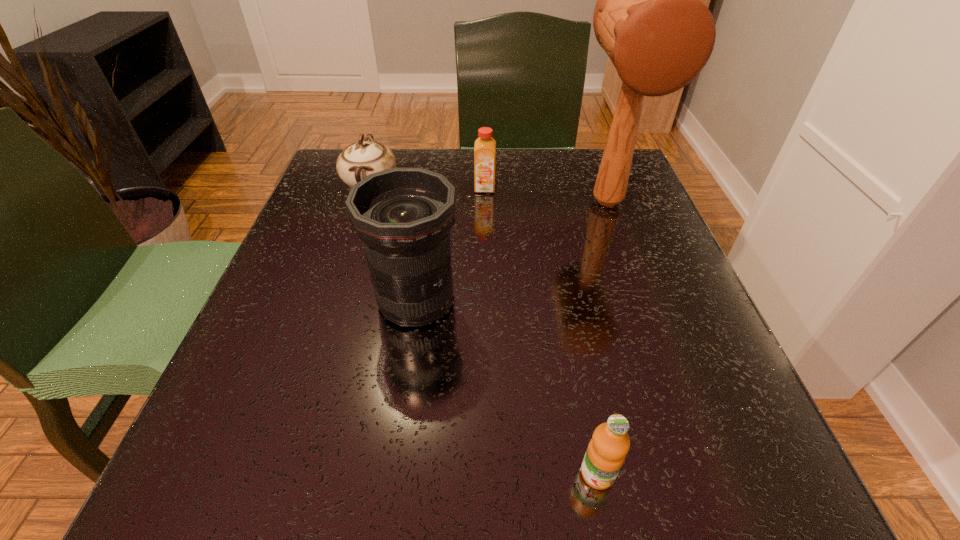
This screenshot has width=960, height=540. In order to click on vacant space located 0.240m on the right of the fourth farthest object in this screenshot , I will do `click(602, 301)`.

At what (x,y) coordinates should I click in order to perform the action: click on free spot located on the front and back of the left orange juice. Please return your answer as a coordinate pair (x, y). Looking at the image, I should click on (486, 228).

Where is `vacant position located 0.250m on the front of the chinaware`? Image resolution: width=960 pixels, height=540 pixels. vacant position located 0.250m on the front of the chinaware is located at coordinates (336, 294).

At what (x,y) coordinates should I click in order to perform the action: click on mallet present at the far edge. Please return your answer as a coordinate pair (x, y). Looking at the image, I should click on (649, 18).

At what (x,y) coordinates should I click in order to perform the action: click on orange juice at the far edge. Please return your answer as a coordinate pair (x, y). This screenshot has width=960, height=540. Looking at the image, I should click on (485, 146).

You are a GUI agent. You are given a task and a screenshot of the screen. Output one action in this format:
    pyautogui.click(x=<x>, y=<y>)
    Task: Click on the chinaware that is at the far edge
    Image resolution: width=960 pixels, height=540 pixels.
    Given the screenshot: What is the action you would take?
    pyautogui.click(x=358, y=160)

At what (x,y) coordinates should I click in order to perform the action: click on object located at the near edge. Please return your answer as a coordinate pair (x, y). Looking at the image, I should click on (605, 455).

Identify the location of object that is at the left edge. Image resolution: width=960 pixels, height=540 pixels. (358, 160).

Find the location of a particular element. This screenshot has height=540, width=960. object at the right edge is located at coordinates (649, 18).

Where is `object located at the far left corner`? object located at the far left corner is located at coordinates (358, 160).